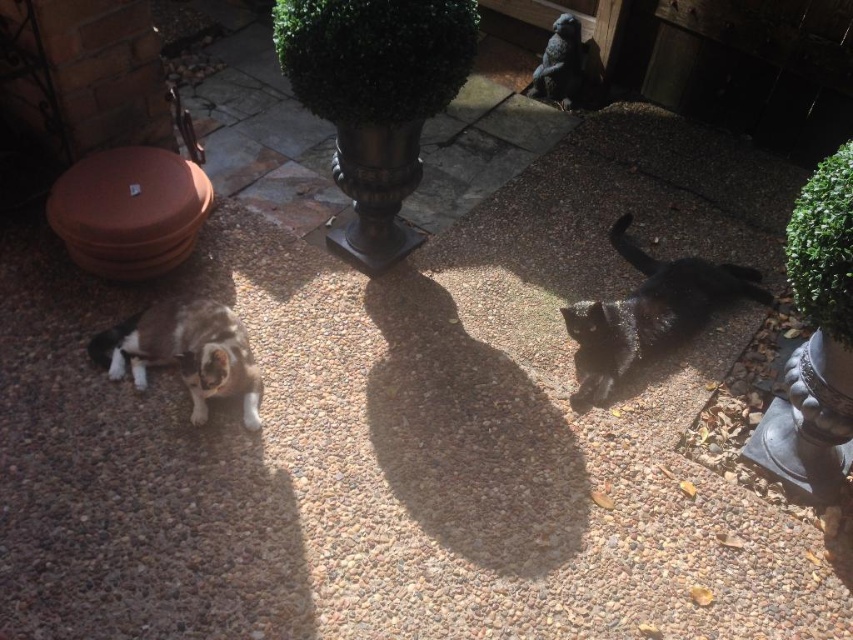
You are a photographer setting up a tripod to capture both the black glossy cat at right and the calico fur cat at lower left in the same frame. Based on their heights, which cat will appear larger in the photo?

The black glossy cat at right will appear larger in the photo because it is much taller than the calico fur cat at lower left.

You are a photographer trying to capture both the black glossy cat at right and the calico fur cat at lower left in a single frame. Based on their sizes, which cat should you focus on first to ensure both fit in the photo?

The black glossy cat at right is bigger than the calico fur cat at lower left, so you should focus on positioning the black glossy cat at right first to ensure there is enough space for both in the frame.

You are standing at the position of the viewer and want to toss a small treat to the black glossy cat at right. The treat can travel up to 3 meters. Will it reach the cat?

The black glossy cat at right is 2.76 meters away from the viewer, so yes, the treat will reach the cat since it is within the 3 meters range.